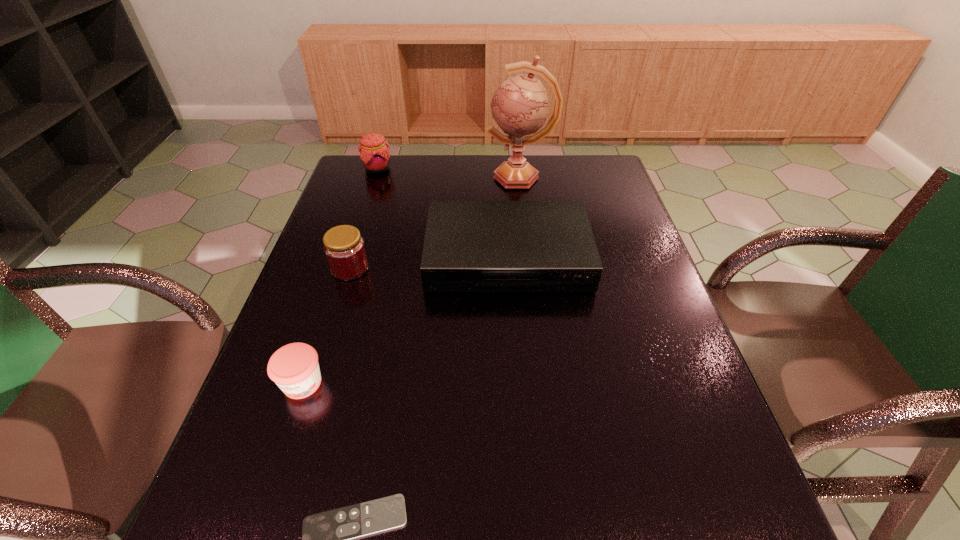
The height and width of the screenshot is (540, 960). I want to click on vacant space located on the front of the second farthest jam, so click(x=336, y=314).

Image resolution: width=960 pixels, height=540 pixels. I want to click on blank space located 0.310m at the front of the CD player for disc insertion, so click(517, 408).

I want to click on vacant space positioned 0.210m on the front label of the shortest jam, so click(x=257, y=518).

The height and width of the screenshot is (540, 960). Find the location of `globe located at the far edge`. globe located at the far edge is located at coordinates (520, 107).

Where is `jam located at the far edge`? The height and width of the screenshot is (540, 960). jam located at the far edge is located at coordinates (374, 154).

Find the location of `object that is at the far left corner`. object that is at the far left corner is located at coordinates (374, 154).

What are the coordinates of `vacant region at the far edge of the desktop` in the screenshot? It's located at (473, 187).

The height and width of the screenshot is (540, 960). I want to click on free space at the left edge of the desktop, so click(226, 457).

Image resolution: width=960 pixels, height=540 pixels. Find the location of `free location at the right edge of the desktop`. free location at the right edge of the desktop is located at coordinates (694, 362).

I want to click on free space at the far right corner of the desktop, so click(x=574, y=178).